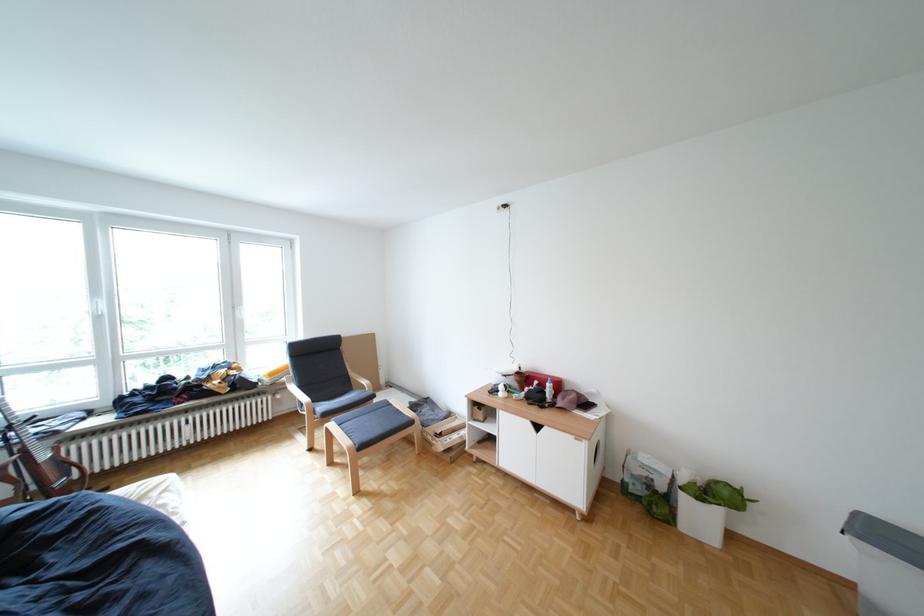
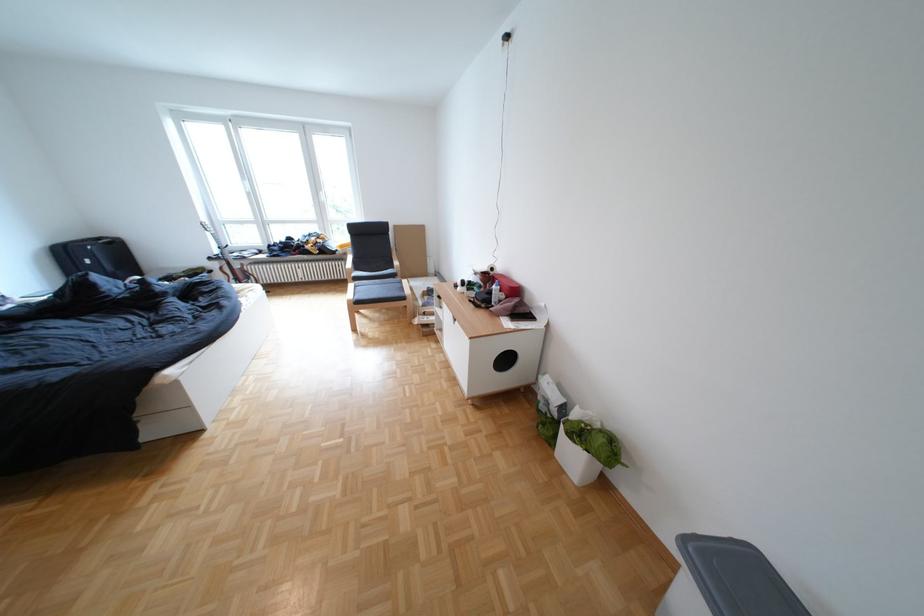
Locate, in the second image, the point that corresponds to (x=866, y=525) in the first image.

(712, 537)